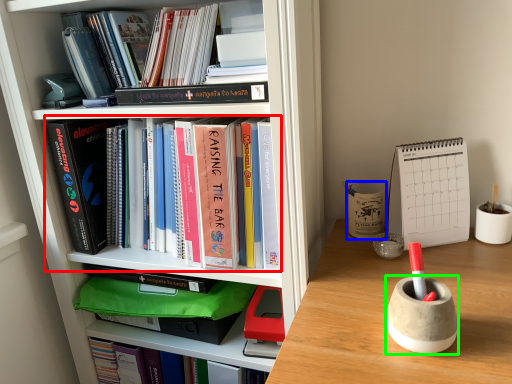
Question: Based on their relative distances, which object is nearer to book (highlighted by a red box)? Choose from stationery (highlighted by a blue box) and stationery (highlighted by a green box).

Choices:
 (A) stationery
 (B) stationery

Answer: (A)